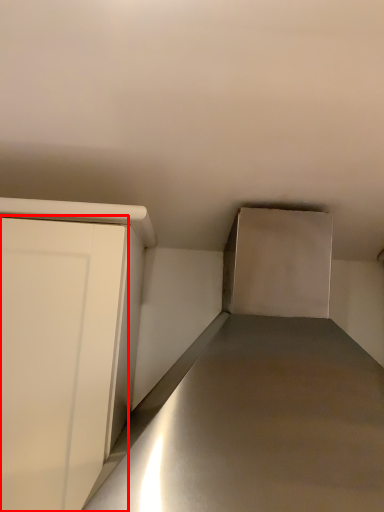
Question: Where is door (annotated by the red box) located in relation to counter top in the image?

Choices:
 (A) left
 (B) right

Answer: (A)